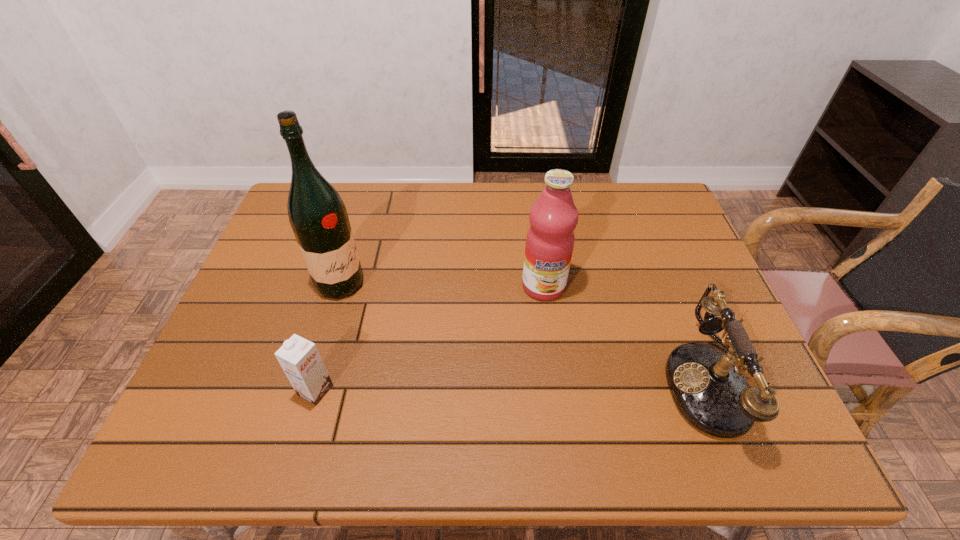
Find the location of a particular element. This screenshot has width=960, height=540. vacant space positioned 0.110m on the label of the third object from left to right is located at coordinates (544, 337).

This screenshot has height=540, width=960. What are the coordinates of `vacant space located on the label of the third object from left to right` in the screenshot? It's located at (544, 337).

You are a GUI agent. You are given a task and a screenshot of the screen. Output one action in this format:
    pyautogui.click(x=<x>, y=<y>)
    Task: Click on the vacant position located 0.140m on the label of the third object from left to right
    
    Given the screenshot: What is the action you would take?
    pyautogui.click(x=544, y=347)

Image resolution: width=960 pixels, height=540 pixels. I want to click on free space located 0.050m on the front-facing side of the liquor, so click(x=373, y=300).

Identify the location of vacant space located 0.120m on the front-facing side of the liquor. (395, 310).

Where is `free spot located on the front-facing side of the liquor`? Image resolution: width=960 pixels, height=540 pixels. free spot located on the front-facing side of the liquor is located at coordinates (397, 312).

Locate an element on the screen. Image resolution: width=960 pixels, height=540 pixels. chocolate milk that is at the near edge is located at coordinates (299, 358).

Where is `telephone at the near edge`? The height and width of the screenshot is (540, 960). telephone at the near edge is located at coordinates (709, 389).

The height and width of the screenshot is (540, 960). Identify the location of object that is positioned at the right edge. (709, 389).

Identify the location of object located in the near right corner section of the desktop. (709, 389).